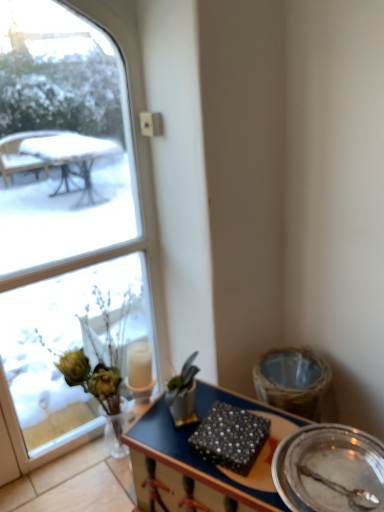
Question: Looking at the image, does pearl-patterned fabric at center seem bigger or smaller compared to translucent glass vase at left?

Choices:
 (A) big
 (B) small

Answer: (B)

Question: Visually, is pearl-patterned fabric at center positioned to the left or to the right of translucent glass vase at left?

Choices:
 (A) left
 (B) right

Answer: (B)

Question: Which of these objects is positioned farthest from the clear glass window at upper left?

Choices:
 (A) translucent glass vase at left
 (B) wooden desk at center
 (C) metallic silver plate at lower right
 (D) pearl-patterned fabric at center

Answer: (C)

Question: Which object is positioned farthest from the translucent glass vase at left?

Choices:
 (A) clear glass window at upper left
 (B) metallic silver plate at lower right
 (C) wooden desk at center
 (D) pearl-patterned fabric at center

Answer: (B)